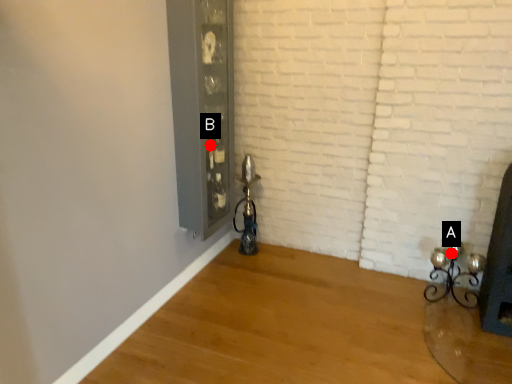
Question: Two points are circled on the image, labeled by A and B beside each circle. Among these points, which one is farthest from the camera?

Choices:
 (A) A is further
 (B) B is further

Answer: (B)